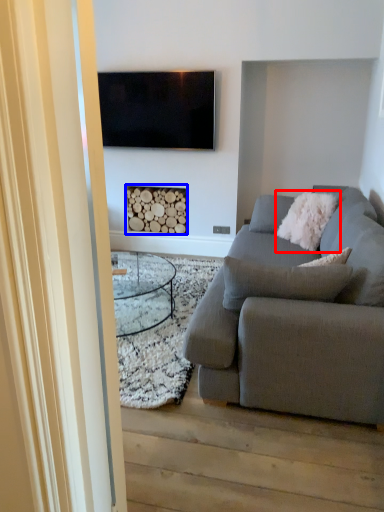
Question: Among these objects, which one is farthest to the camera, pillow (highlighted by a red box) or fireplace (highlighted by a blue box)?

Choices:
 (A) pillow
 (B) fireplace

Answer: (B)